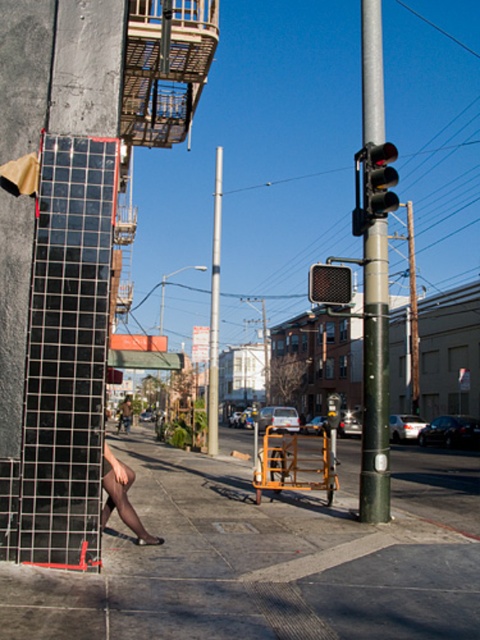
Does point (362, 100) come farther from viewer compared to point (216, 160)?

No.

Does green metallic pole at center appear on the left side of smooth silver pole at center?

No, green metallic pole at center is not to the left of smooth silver pole at center.

Between point (365, 404) and point (216, 246), which one is positioned in front?

Point (365, 404)

I want to click on green metallic pole at center, so click(x=374, y=378).

Who is more forward, (347, 580) or (129, 524)?

Positioned in front is point (347, 580).

Is concrete sidewalk at lower left positioned at the back of black tights at lower left?

No, concrete sidewalk at lower left is closer to the viewer.

Does point (223, 544) lie behind point (117, 465)?

That is True.

You are a GUI agent. You are given a task and a screenshot of the screen. Output one action in this format:
    pyautogui.click(x=<x>, y=<y>)
    Task: Click on the concrete sidewalk at lower left
    
    Given the screenshot: What is the action you would take?
    coord(249,566)

Does green metallic pole at center appear on the left side of black glass traffic light at upper right?

Yes, green metallic pole at center is to the left of black glass traffic light at upper right.

Between point (380, 465) and point (372, 164), which one is positioned behind?

Point (372, 164)

The image size is (480, 640). I want to click on green metallic pole at center, so click(x=374, y=378).